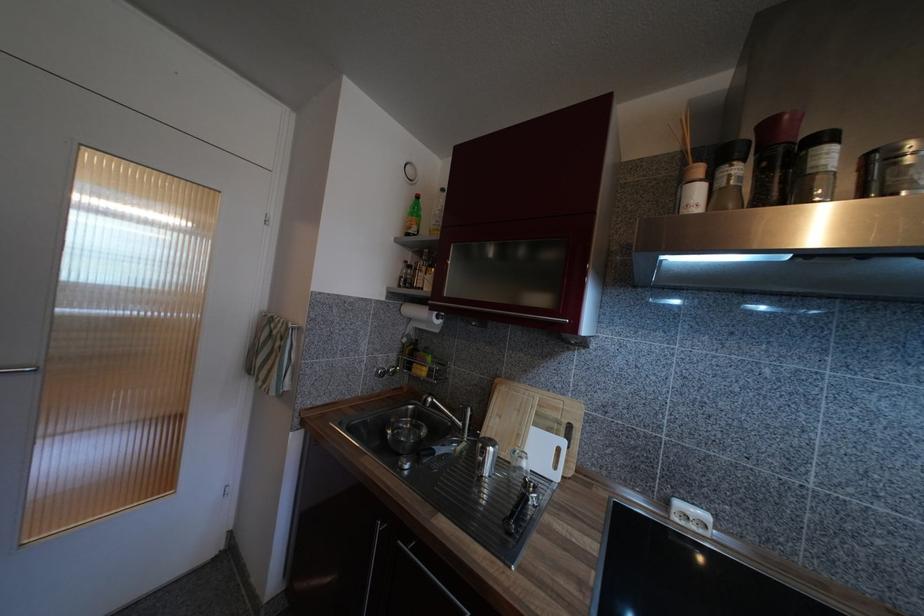
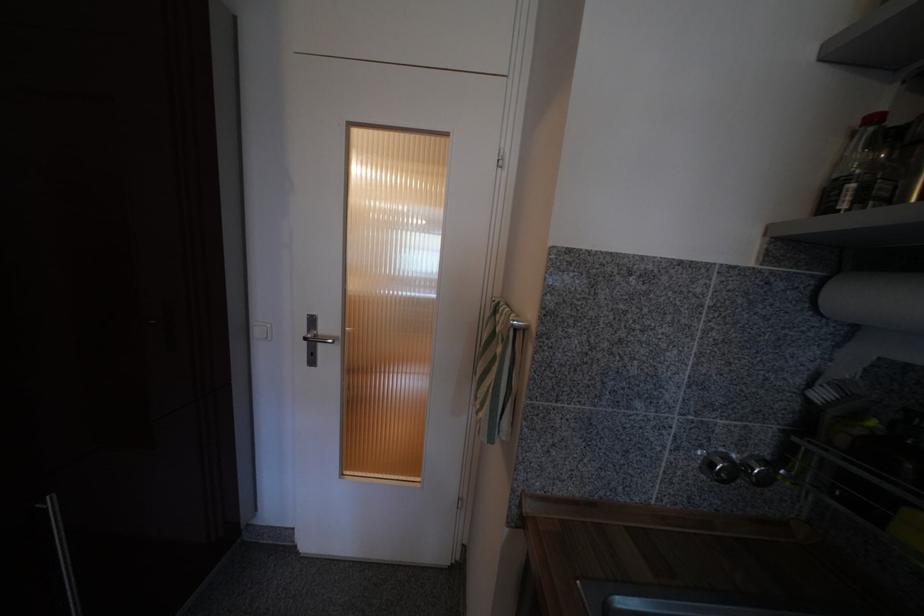
In the second image, find the point that corresponds to (409,264) in the first image.

(879, 121)